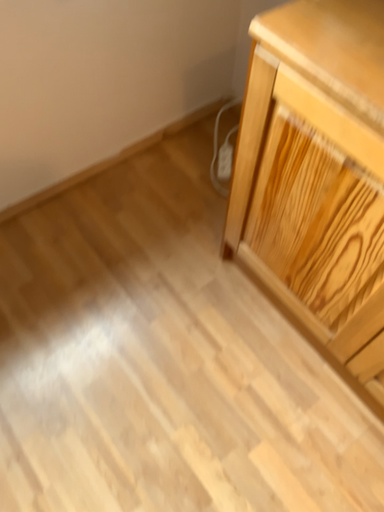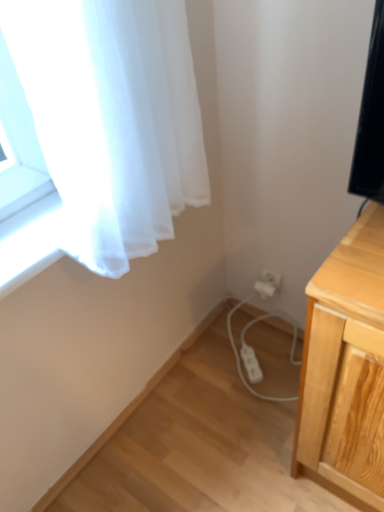
Question: How did the camera likely rotate when shooting the video?

Choices:
 (A) rotated downward
 (B) rotated upward

Answer: (B)